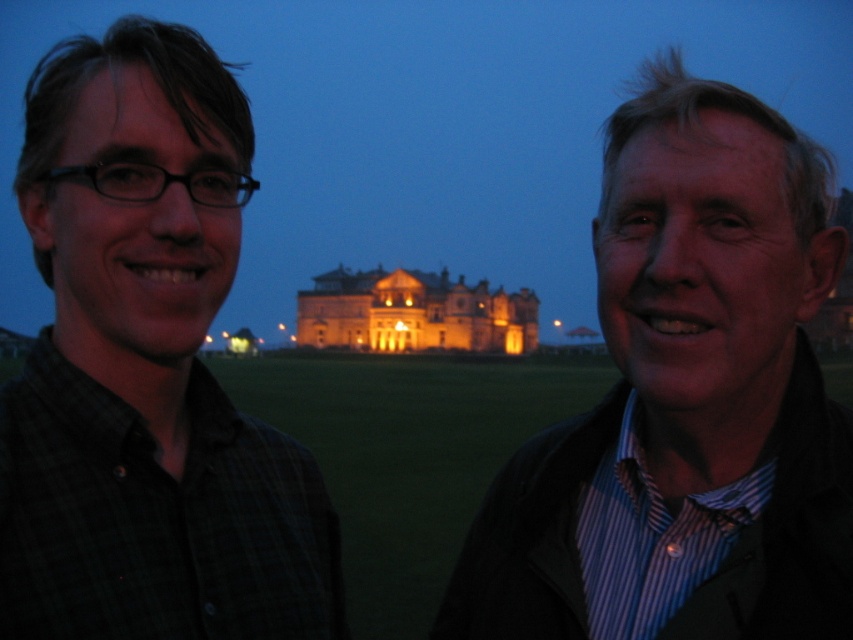
You are a photographer trying to capture a photo of the golden illuminated palace at center without any people in the frame. Currently, the striped shirt at center is blocking your view. Which direction should you move to ensure the palace is visible and the striped shirt is out of the shot?

The striped shirt at center is to the right of the golden illuminated palace at center. To avoid the striped shirt at center, move to the left side of the palace so it will be out of frame.

You are standing in front of the grand building and see two points marked in the image. Which point, point (709, 365) or point (322, 332), is closer to you?

Point (709, 365) is closer to the viewer than point (322, 332).